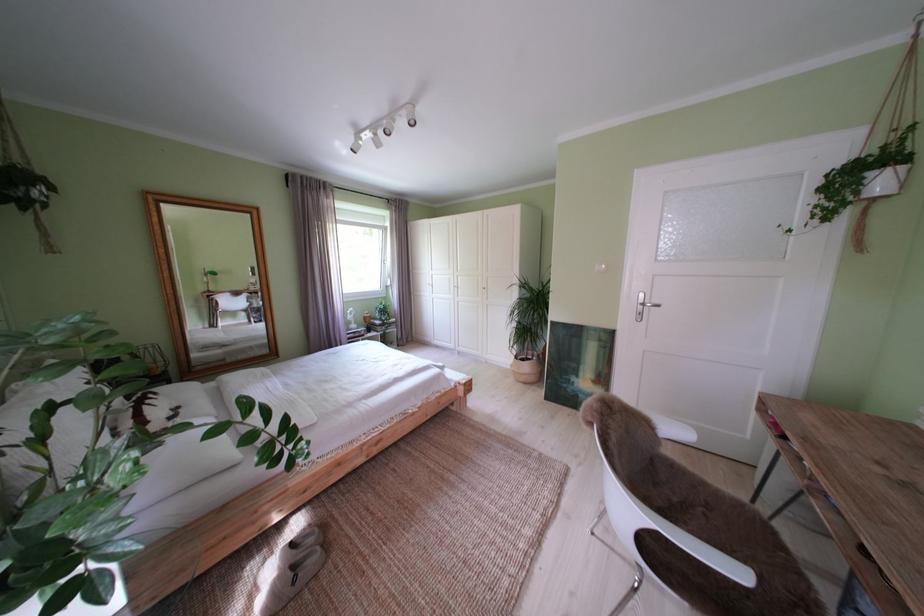
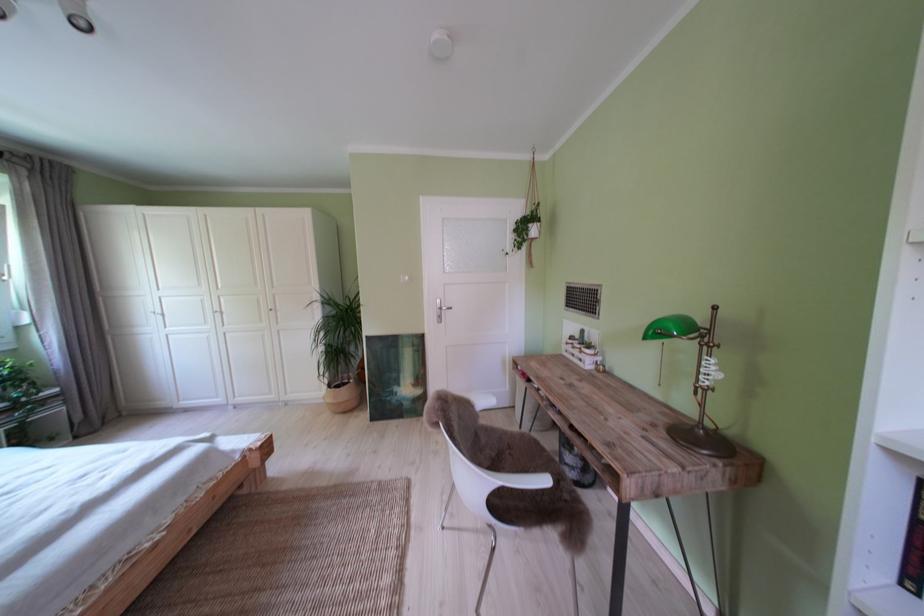
In the second image, find the point that corresponds to point 527,363 in the first image.

(341, 392)